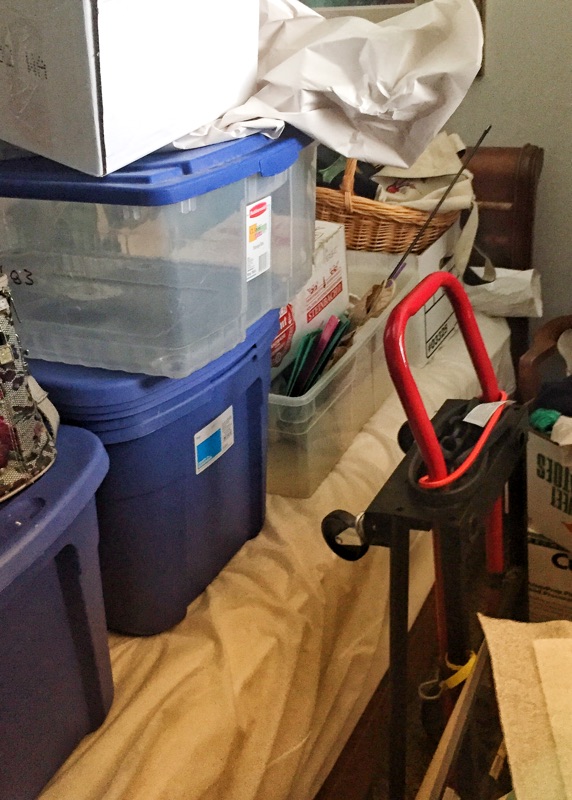
At what (x,y) coordinates should I click in order to perform the action: click on wicker basket. Please return your answer as a coordinate pair (x, y). Looking at the image, I should click on [355, 218].